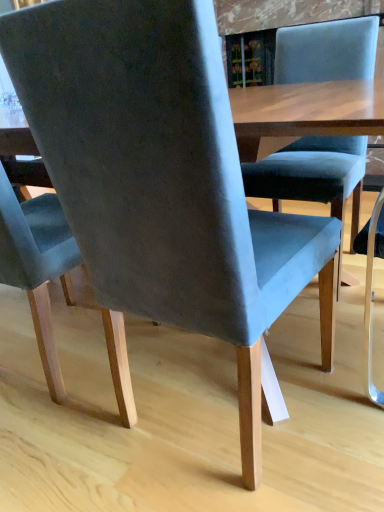
Describe the element at coordinates (37, 264) in the screenshot. The height and width of the screenshot is (512, 384). I see `suede-like gray chair at center` at that location.

Locate an element on the screen. suede-like gray chair at center is located at coordinates (37, 264).

This screenshot has height=512, width=384. In order to click on suede-like gray chair at center in this screenshot , I will do `click(37, 264)`.